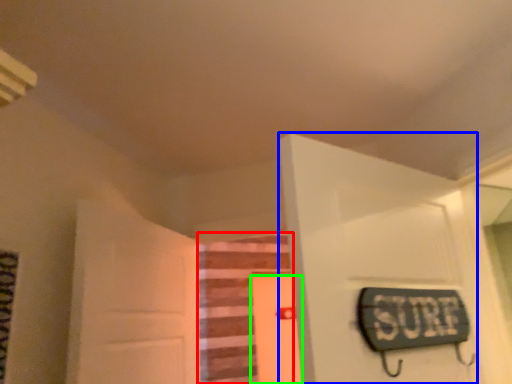
Question: Based on their relative distances, which object is farther from stairwell (highlighted by a red box)? Choose from door (highlighted by a blue box) and door (highlighted by a green box).

Choices:
 (A) door
 (B) door

Answer: (A)